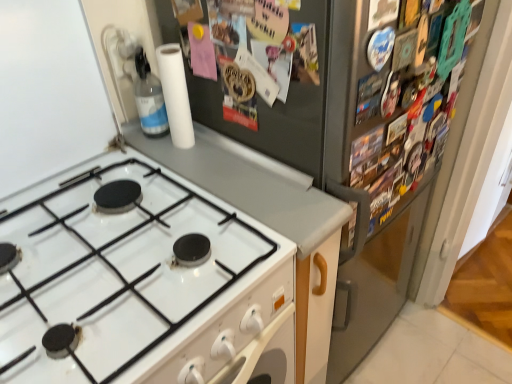
What are the coordinates of `empty space that is ontop of white matte countertop at center` in the screenshot? It's located at (236, 173).